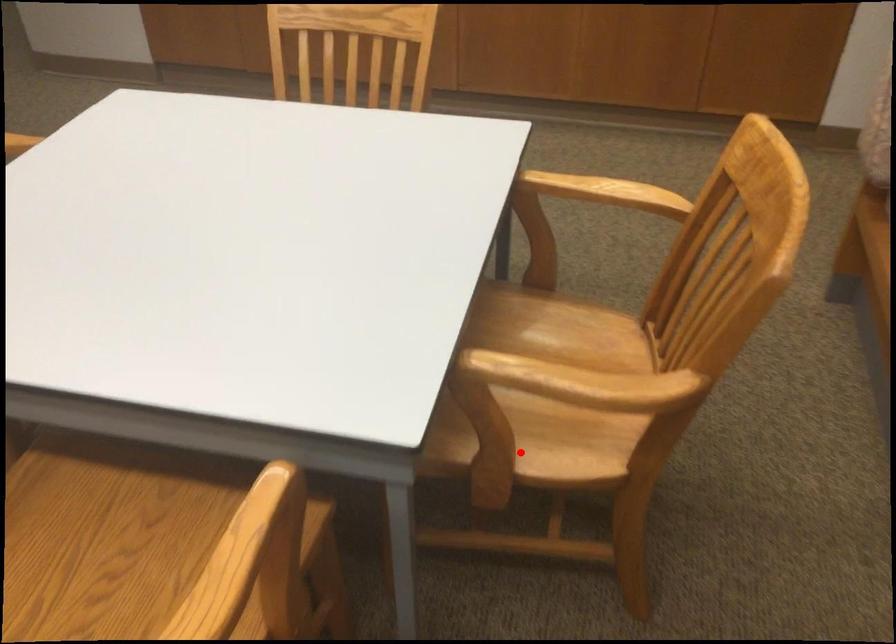
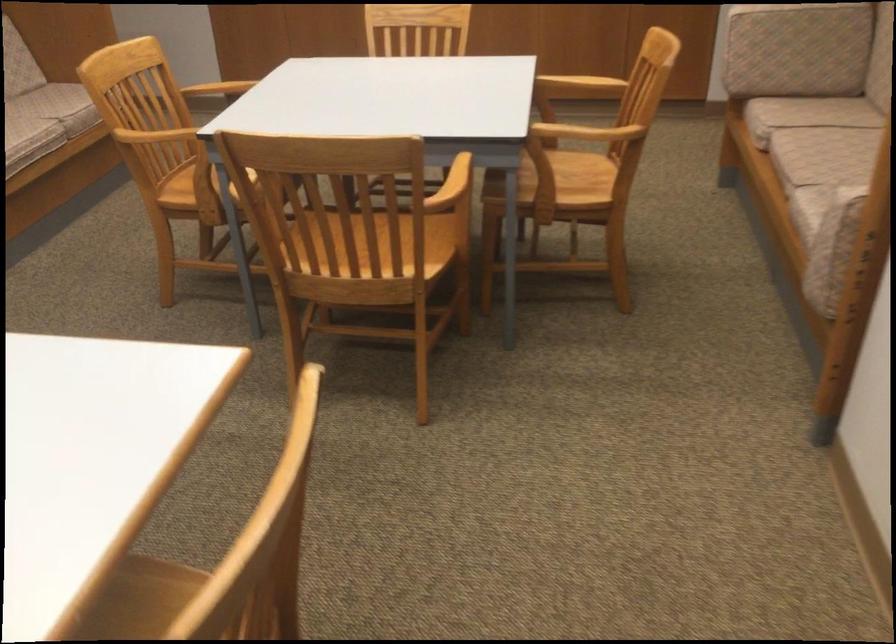
Find the pixel in the second image that matches the highlighted location in the first image.

(556, 182)